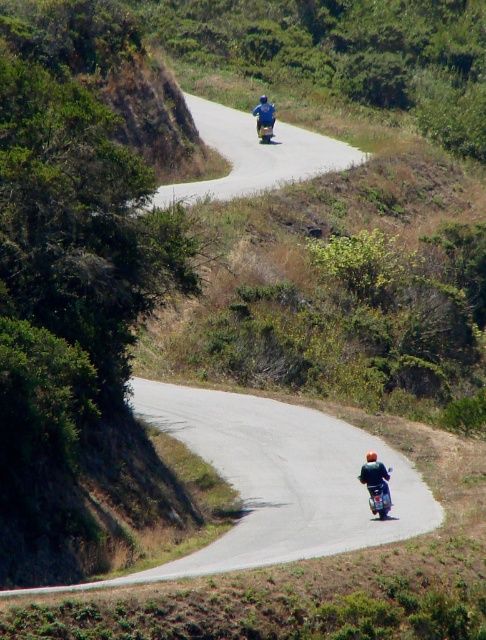
Question: Which object is the farthest from the smooth asphalt road at center?

Choices:
 (A) dark blue jacket at lower right
 (B) blue metallic motorcycle at upper center
 (C) blue fabric shirt at upper center

Answer: (C)

Question: Observing the image, what is the correct spatial positioning of shiny metallic motorcycle at lower right in reference to dark blue jacket at lower right?

Choices:
 (A) right
 (B) left

Answer: (A)

Question: Which point is closer to the camera?

Choices:
 (A) blue fabric shirt at upper center
 (B) shiny metallic motorcycle at lower right
 (C) dark blue jacket at lower right

Answer: (B)

Question: Can you confirm if smooth asphalt road at center is bigger than blue metallic motorcycle at upper center?

Choices:
 (A) no
 (B) yes

Answer: (B)

Question: Among these objects, which one is nearest to the camera?

Choices:
 (A) blue metallic motorcycle at upper center
 (B) blue fabric shirt at upper center
 (C) shiny metallic motorcycle at lower right

Answer: (C)

Question: Is dark blue jacket at lower right bigger than blue fabric shirt at upper center?

Choices:
 (A) no
 (B) yes

Answer: (B)